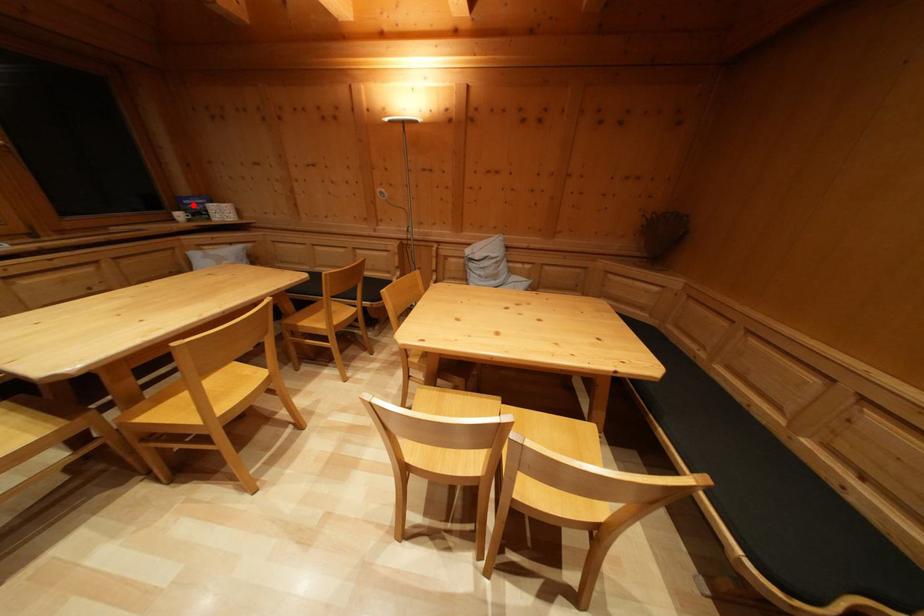
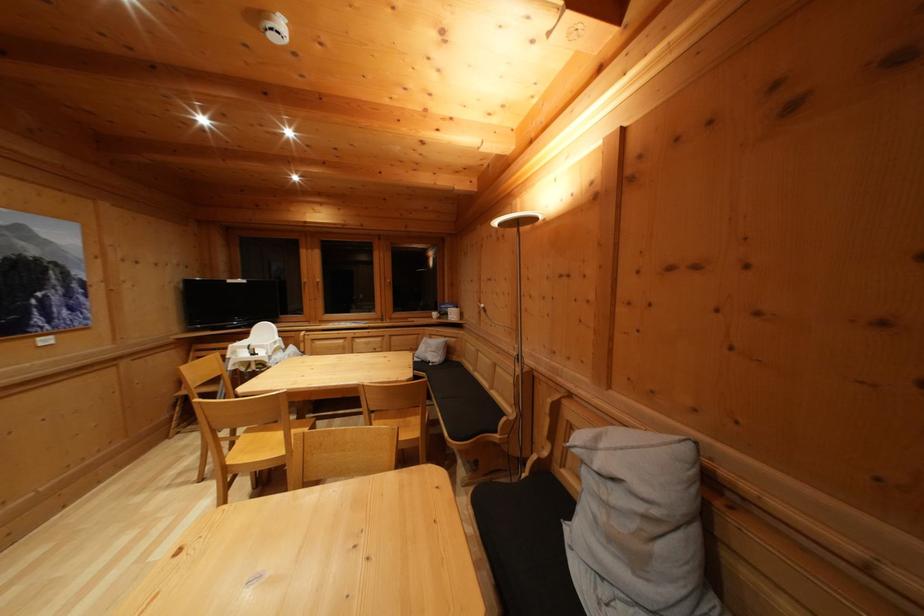
Find the pixel in the second image that matches the highlighted location in the first image.

(450, 310)